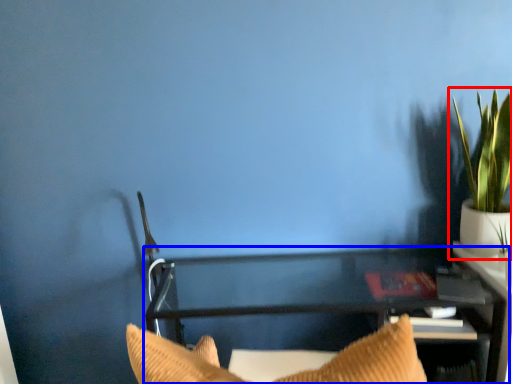
Question: Among these objects, which one is nearest to the camera, houseplant (highlighted by a red box) or furniture (highlighted by a blue box)?

Choices:
 (A) houseplant
 (B) furniture

Answer: (B)